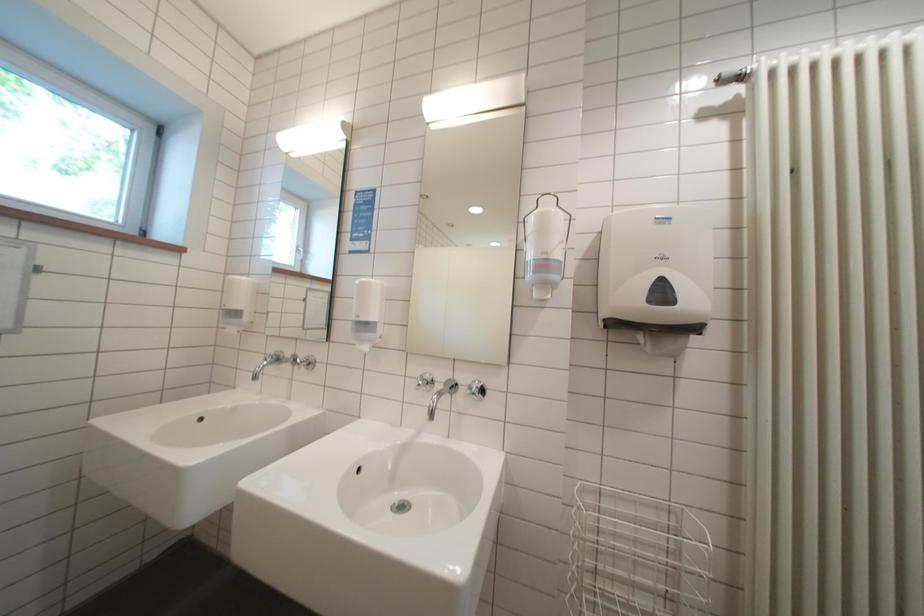
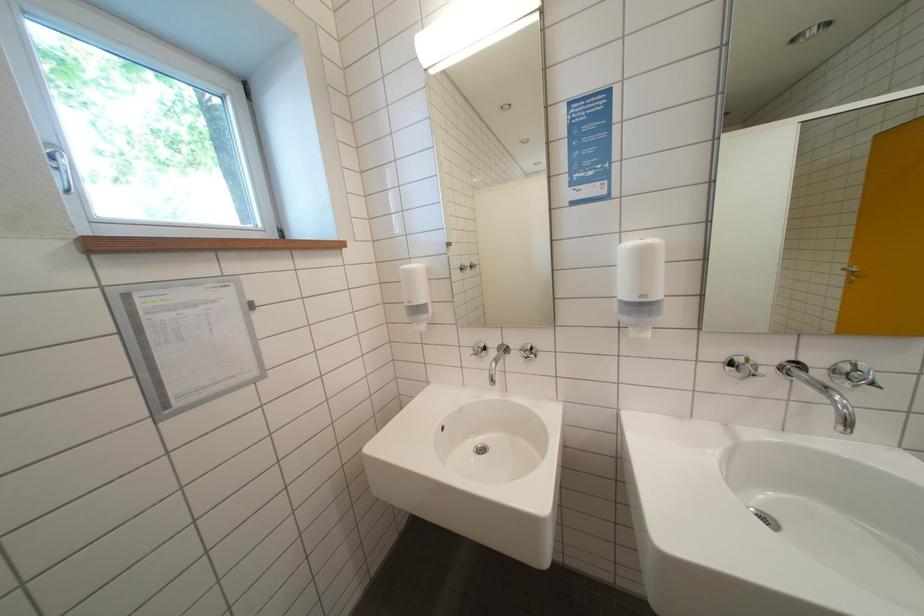
Question: The first image is from the beginning of the video and the second image is from the end. How did the camera likely rotate when shooting the video?

Choices:
 (A) Left
 (B) Right
 (C) Up
 (D) Down

Answer: (D)